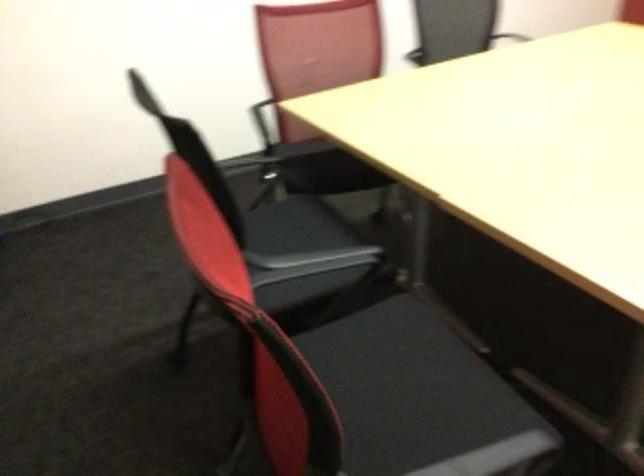
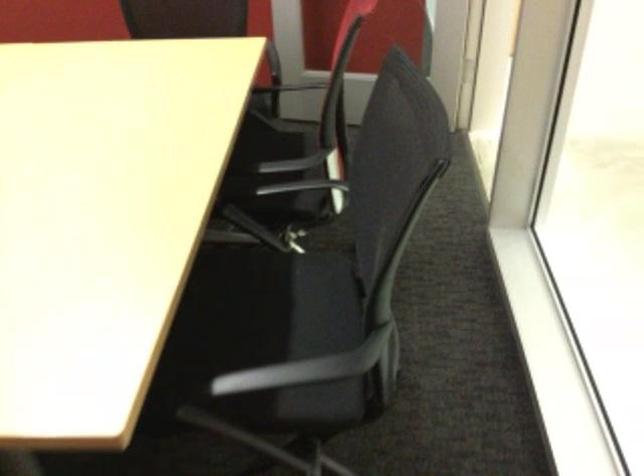
Question: Based on the continuous images, in which direction is the camera rotating? Reply with the corresponding letter.

Choices:
 (A) Left
 (B) Right
 (C) Up
 (D) Down

Answer: (B)